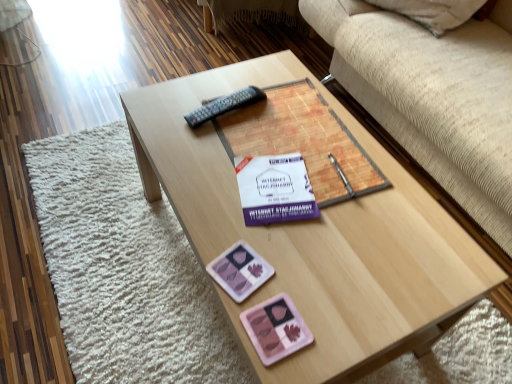
Question: Considering the positions of point (252, 258) and point (353, 196), is point (252, 258) closer or farther from the camera than point (353, 196)?

Choices:
 (A) closer
 (B) farther

Answer: (A)

Question: Do you think pink plastic at lower center, which appears as the 1th currency when viewed from the top, is within matte paper book at center, or outside of it?

Choices:
 (A) outside
 (B) inside

Answer: (A)

Question: Which of these objects is positioned closest to the beige fabric studio couch at upper right?

Choices:
 (A) wooden coffee table at center
 (B) matte paper book at center
 (C) pink plastic at lower center, which appears as the 1th currency when viewed from the top
 (D) pink matte palette at center, which ranks as the second currency in top-to-bottom order
 (E) black plastic remote at center

Answer: (B)

Question: Estimate the real-world distances between objects in this image. Which object is closer to the wooden coffee table at center?

Choices:
 (A) beige fabric studio couch at upper right
 (B) black plastic remote at center
 (C) white paper at center
 (D) pink matte palette at center, which is the first currency from bottom to top
 (E) pink plastic at lower center, which appears as the 1th currency when viewed from the top

Answer: (C)